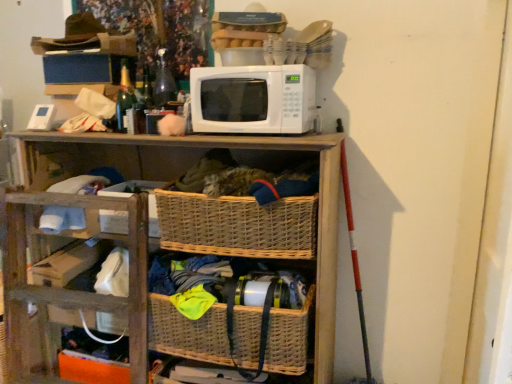
Question: From the image's perspective, is white cardboard box at center, which ranks as the 1th storage box in bottom-to-top order, above or below woven wood shelf at center?

Choices:
 (A) below
 (B) above

Answer: (B)

Question: In terms of width, does white cardboard box at center, which ranks as the 1th storage box in bottom-to-top order, look wider or thinner when compared to woven wood shelf at center?

Choices:
 (A) thin
 (B) wide

Answer: (A)

Question: Considering the real-world distances, which object is closest to the blue cardboard box at upper left, which appears as the second storage box when ordered from the bottom?

Choices:
 (A) woven basket at center
 (B) white cardboard box at center, which ranks as the 1th storage box in bottom-to-top order
 (C) green glass bottle at upper left
 (D) woven wood shelf at center
 (E) woven wicker basket at lower center, which is the 1th basket in bottom-to-top order

Answer: (C)

Question: Which is farther from the woven brown basket at center, which ranks as the 1th basket in top-to-bottom order?

Choices:
 (A) woven wood shelf at center
 (B) white cardboard box at center, the 2th storage box from the top
 (C) woven basket at center
 (D) green glass bottle at upper left
 (E) white matte microwave at upper center

Answer: (D)